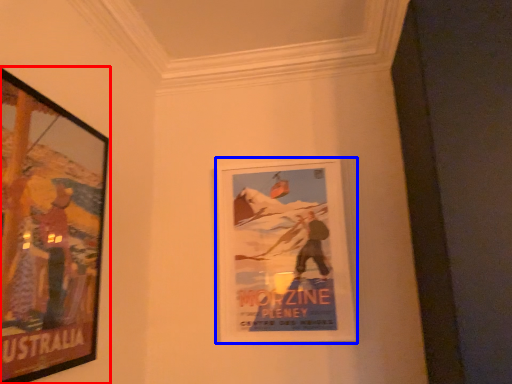
Question: Among these objects, which one is nearest to the camera, picture frame (highlighted by a red box) or picture frame (highlighted by a blue box)?

Choices:
 (A) picture frame
 (B) picture frame

Answer: (A)